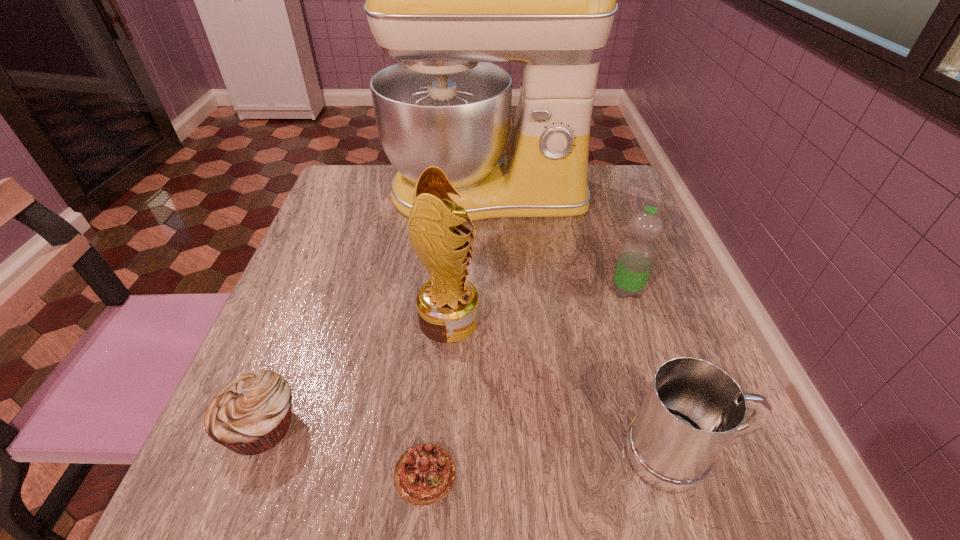
The width and height of the screenshot is (960, 540). What are the coordinates of `water bottle that is at the right edge` in the screenshot? It's located at (637, 255).

Locate an element on the screen. The height and width of the screenshot is (540, 960). mug that is positioned at the right edge is located at coordinates (692, 409).

In order to click on object that is at the far left corner in this screenshot , I will do `click(446, 0)`.

The width and height of the screenshot is (960, 540). I want to click on object present at the near left corner, so click(x=250, y=415).

In order to click on object that is at the far right corner in this screenshot , I will do `click(446, 0)`.

This screenshot has width=960, height=540. What are the coordinates of `object that is at the near right corner` in the screenshot? It's located at (692, 409).

Where is `free location at the near edge of the desktop`? The height and width of the screenshot is (540, 960). free location at the near edge of the desktop is located at coordinates (558, 501).

In order to click on vacant space at the left edge in this screenshot , I will do `click(271, 363)`.

Image resolution: width=960 pixels, height=540 pixels. I want to click on free location at the far left corner, so click(360, 177).

Where is `blank area at the near left corner`? The width and height of the screenshot is (960, 540). blank area at the near left corner is located at coordinates (194, 502).